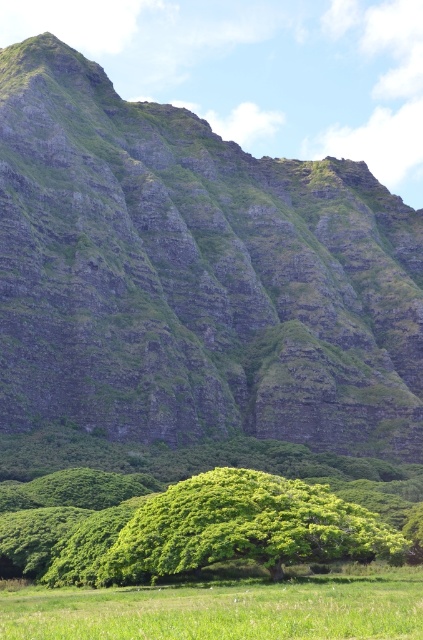
You are a hiker who wants to take a photo of the green leafy tree at center. You are currently standing on the green grass at lower center. Can you see the entire tree without any obstruction?

The green grass at lower center is in front of the green leafy tree at center, so you can see the entire tree without obstruction because the grass is closer to you and does not block the view of the tree behind it.

You are standing at the base of the green grassy mountain at upper center and want to walk to the green leafy tree at center. Which direction should you head to reach the tree?

The green grassy mountain at upper center is positioned over the green leafy tree at center, so you should head downward from the mountain to reach the tree.